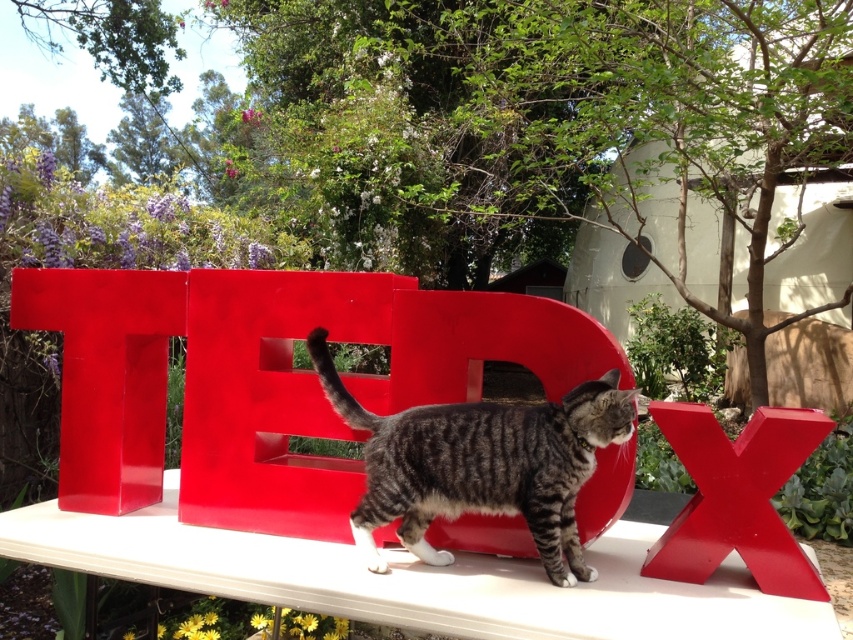
Question: Based on their relative distances, which object is nearer to the glossy plastic x at right?

Choices:
 (A) glossy plastic letter t at center
 (B) white glossy park bench at center

Answer: (B)

Question: Does glossy plastic letter t at center have a lesser width compared to glossy plastic x at right?

Choices:
 (A) no
 (B) yes

Answer: (A)

Question: Which is nearer to the glossy plastic letter t at center?

Choices:
 (A) tabby fur cat at center
 (B) glossy plastic x at right
 (C) white glossy park bench at center

Answer: (C)

Question: From the image, what is the correct spatial relationship of white glossy park bench at center in relation to tabby fur cat at center?

Choices:
 (A) above
 (B) below

Answer: (B)

Question: Does white glossy park bench at center have a larger size compared to glossy plastic letter t at center?

Choices:
 (A) yes
 (B) no

Answer: (A)

Question: Which of the following is the closest to the observer?

Choices:
 (A) white glossy park bench at center
 (B) glossy plastic x at right
 (C) glossy plastic letter t at center

Answer: (A)